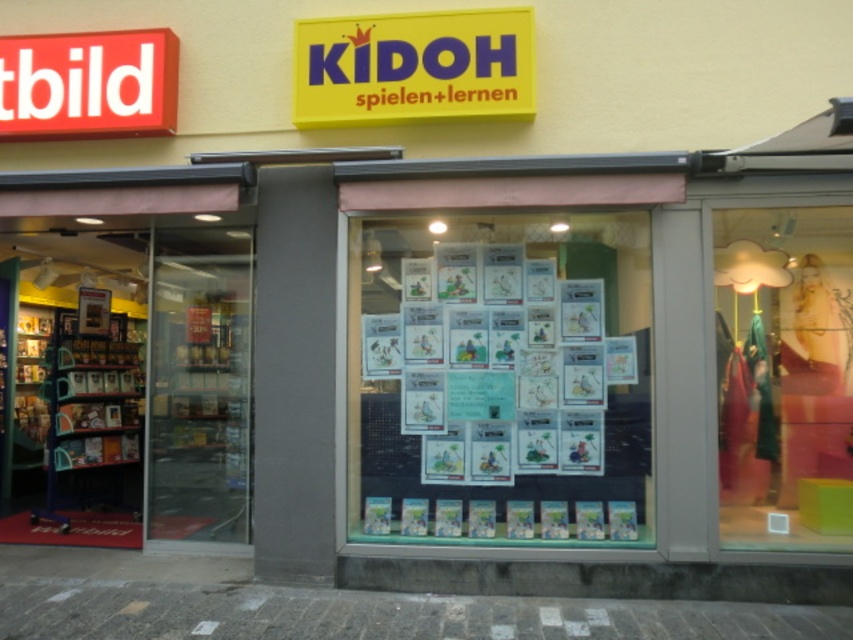
In the scene shown: Can you confirm if white paper posters at center is wider than red plastic sign at upper left?

Yes, white paper posters at center is wider than red plastic sign at upper left.

Is the position of white paper posters at center less distant than that of red plastic sign at upper left?

Yes, it is.

I want to click on white paper posters at center, so click(498, 378).

Can you confirm if white paper posters at center is smaller than matte pink dress at right?

Indeed, white paper posters at center has a smaller size compared to matte pink dress at right.

Is point (610, 385) positioned behind point (761, 300)?

No, it is in front of (761, 300).

The width and height of the screenshot is (853, 640). Find the location of `white paper posters at center`. white paper posters at center is located at coordinates (498, 378).

Does point (479, 532) come farther from viewer compared to point (360, 84)?

No, (479, 532) is closer to viewer.

Is white paper posters at center thinner than yellow plastic sign at upper center?

In fact, white paper posters at center might be wider than yellow plastic sign at upper center.

Which is behind, point (566, 500) or point (390, 52)?

The point (566, 500) is more distant.

Find the location of a particular element. This screenshot has width=853, height=640. white paper posters at center is located at coordinates (498, 378).